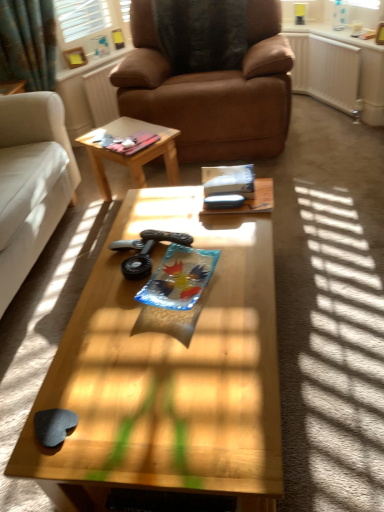
Locate an element on the screen. This screenshot has width=384, height=512. vacant area to the left of black plastic game controller at center is located at coordinates (108, 276).